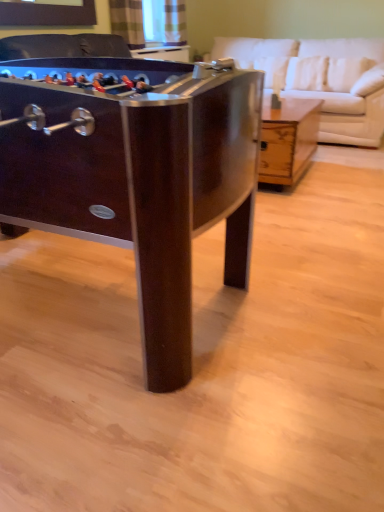
Question: Does white leather couch at upper right have a greater width compared to dark wood foosball table at left, which ranks as the 2th table in back-to-front order?

Choices:
 (A) yes
 (B) no

Answer: (B)

Question: Does white leather couch at upper right have a smaller size compared to dark wood foosball table at left, positioned as the 2th table in right-to-left order?

Choices:
 (A) no
 (B) yes

Answer: (B)

Question: Would you say dark wood foosball table at left, the 1th table positioned from the front, is part of white leather couch at upper right's contents?

Choices:
 (A) no
 (B) yes

Answer: (A)

Question: Is white leather couch at upper right positioned before dark wood foosball table at left, which is the first table in left-to-right order?

Choices:
 (A) yes
 (B) no

Answer: (B)

Question: Does white leather couch at upper right turn towards dark wood foosball table at left, positioned as the 2th table in right-to-left order?

Choices:
 (A) yes
 (B) no

Answer: (A)

Question: Based on their sizes in the image, would you say wooden coffee table at center, which is counted as the 1th table, starting from the back, is bigger or smaller than dark wood foosball table at left, which ranks as the 2th table in back-to-front order?

Choices:
 (A) small
 (B) big

Answer: (A)

Question: Would you say wooden coffee table at center, marked as the second table in a front-to-back arrangement, is to the left or to the right of dark wood foosball table at left, which is the first table in left-to-right order, in the picture?

Choices:
 (A) right
 (B) left

Answer: (A)

Question: Looking at their shapes, would you say wooden coffee table at center, marked as the second table in a front-to-back arrangement, is wider or thinner than dark wood foosball table at left, the 1th table positioned from the front?

Choices:
 (A) wide
 (B) thin

Answer: (B)

Question: Which is correct: wooden coffee table at center, the 1th table viewed from the right, is inside dark wood foosball table at left, the 1th table positioned from the front, or outside of it?

Choices:
 (A) outside
 (B) inside

Answer: (A)

Question: In terms of width, does dark wood foosball table at left, the 1th table positioned from the front, look wider or thinner when compared to wooden coffee table at center, which is counted as the 1th table, starting from the back?

Choices:
 (A) wide
 (B) thin

Answer: (A)

Question: From the image's perspective, is dark wood foosball table at left, the 1th table positioned from the front, above or below wooden coffee table at center, marked as the second table in a front-to-back arrangement?

Choices:
 (A) below
 (B) above

Answer: (A)

Question: In the image, is dark wood foosball table at left, the 1th table positioned from the front, positioned in front of or behind wooden coffee table at center, which is counted as the 1th table, starting from the back?

Choices:
 (A) front
 (B) behind

Answer: (A)

Question: Is point (122, 188) positioned closer to the camera than point (274, 136)?

Choices:
 (A) closer
 (B) farther

Answer: (A)

Question: Is wooden coffee table at center, marked as the second table in a front-to-back arrangement, wider or thinner than white leather couch at upper right?

Choices:
 (A) thin
 (B) wide

Answer: (A)

Question: Would you say wooden coffee table at center, the 1th table viewed from the right, is to the left or to the right of white leather couch at upper right in the picture?

Choices:
 (A) right
 (B) left

Answer: (B)